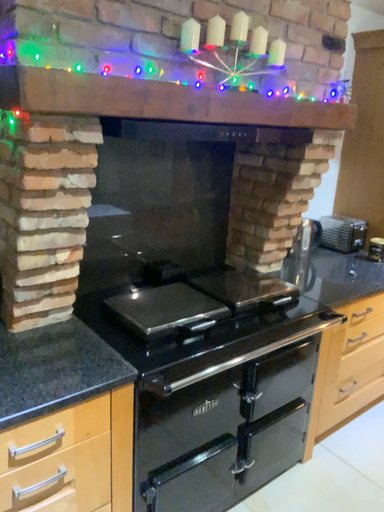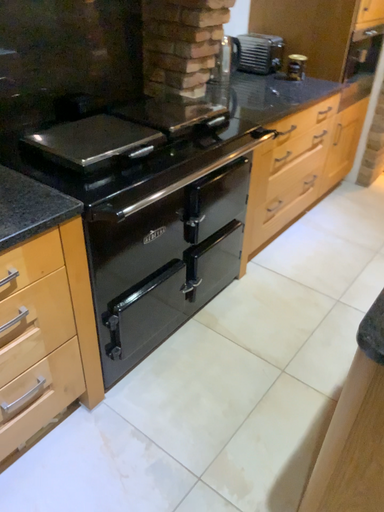
Question: How did the camera likely rotate when shooting the video?

Choices:
 (A) rotated left
 (B) rotated right

Answer: (B)